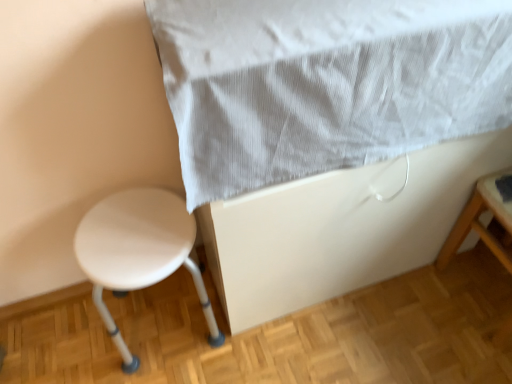
Question: Is point (210, 324) positioned closer to the camera than point (248, 178)?

Choices:
 (A) closer
 (B) farther

Answer: (B)

Question: From the image's perspective, relative to white textured fabric at upper center, is white plastic stool at lower left above or below?

Choices:
 (A) below
 (B) above

Answer: (A)

Question: Looking at their shapes, would you say white plastic stool at lower left is wider or thinner than white textured fabric at upper center?

Choices:
 (A) thin
 (B) wide

Answer: (A)

Question: In terms of size, does white textured fabric at upper center appear bigger or smaller than white plastic stool at lower left?

Choices:
 (A) small
 (B) big

Answer: (B)

Question: Considering the positions of point (478, 44) and point (182, 249), is point (478, 44) closer or farther from the camera than point (182, 249)?

Choices:
 (A) closer
 (B) farther

Answer: (A)

Question: In terms of height, does white textured fabric at upper center look taller or shorter compared to white plastic stool at lower left?

Choices:
 (A) short
 (B) tall

Answer: (A)

Question: From a real-world perspective, is white textured fabric at upper center physically located above or below white plastic stool at lower left?

Choices:
 (A) below
 (B) above

Answer: (B)